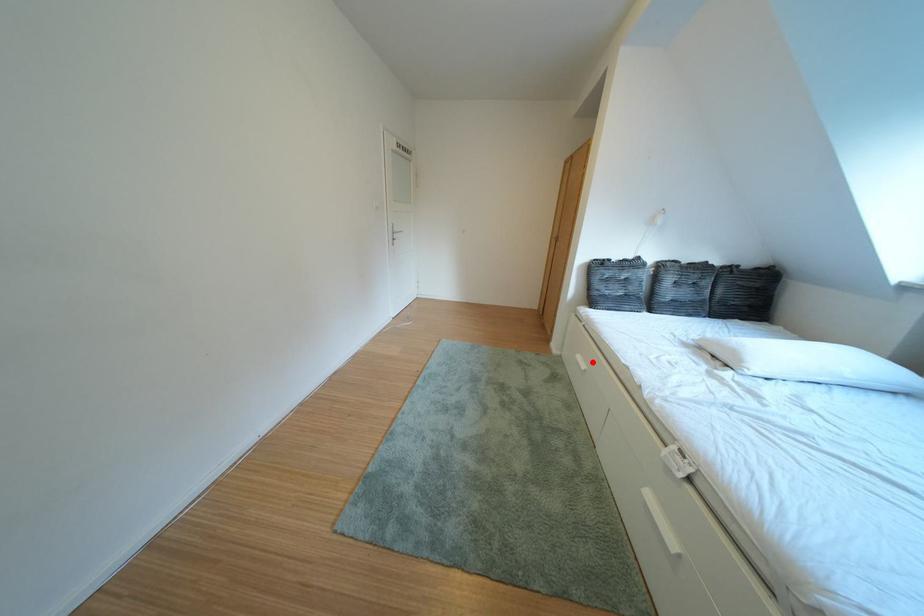
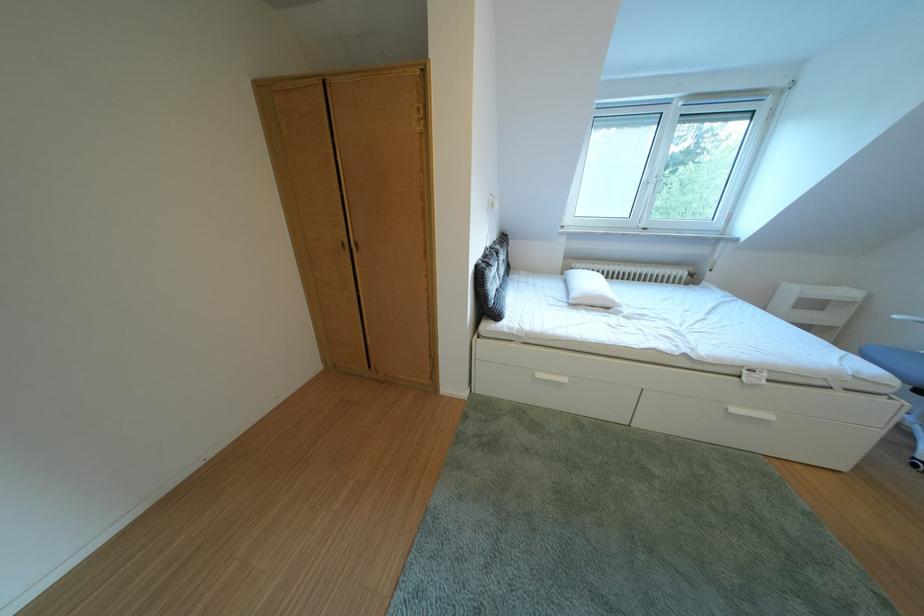
Find the pixel in the second image that matches the highlighted location in the first image.

(553, 381)